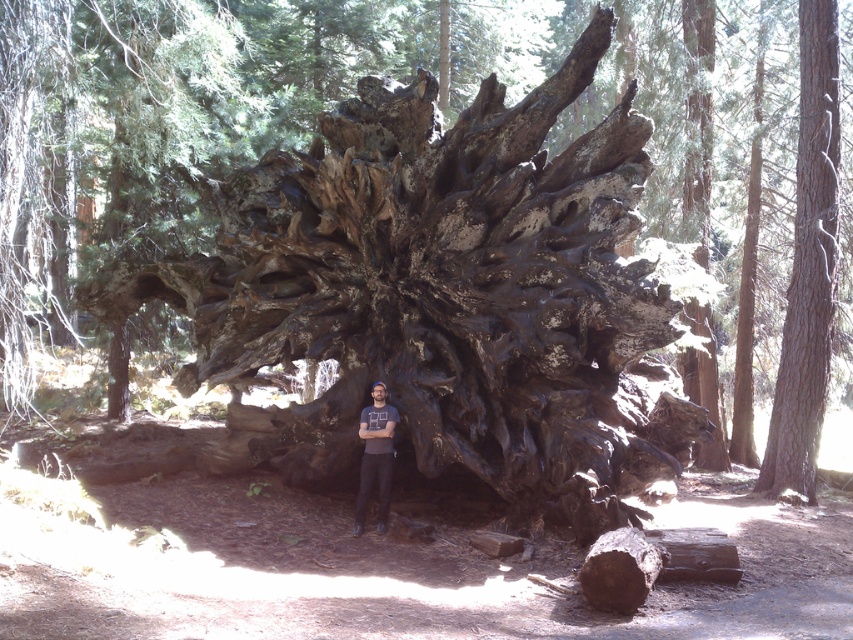
You are standing in front of the tree stump and want to touch the smooth brown bark at right. Based on its coordinates, where should you look to find it?

The smooth brown bark at right is located at point (808, 266), so you should look towards the lower right area of the stump to find it.

You are standing at the location of the viewer in the image. There is a smooth brown bark at right. If you want to touch it, how many steps would you need to take if each step is approximately 3 feet long?

The smooth brown bark at right is 36.56 feet away from the viewer. Since each step is about 3 feet, you would need to take approximately 12 steps to reach it.